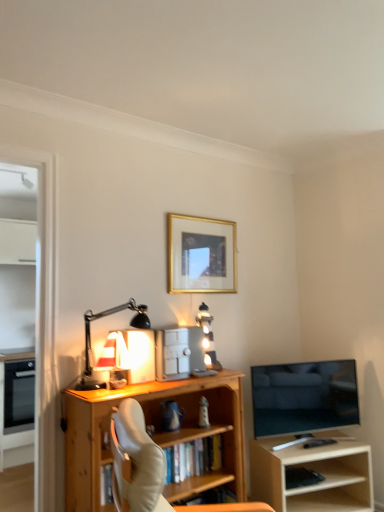
This screenshot has width=384, height=512. I want to click on free region under metallic silver safe at center, the first appliance in the front-to-back sequence (from a real-world perspective), so click(x=198, y=372).